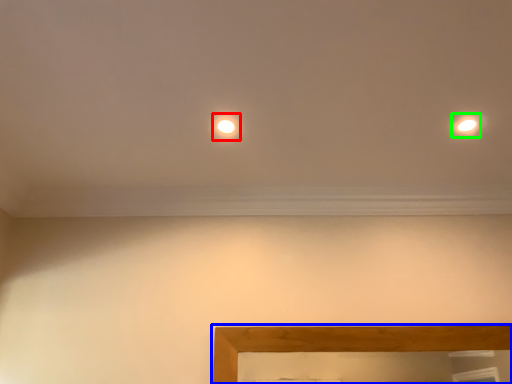
Question: Based on their relative distances, which object is nearer to glow (highlighted by a red box)? Choose from picture frame (highlighted by a blue box) and light (highlighted by a green box).

Choices:
 (A) picture frame
 (B) light

Answer: (B)